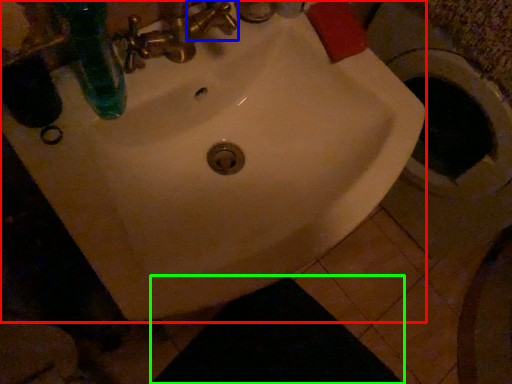
Question: Which is farther away from sink (highlighted by a red box)? plumbing fixture (highlighted by a blue box) or dark (highlighted by a green box)?

Choices:
 (A) plumbing fixture
 (B) dark

Answer: (B)